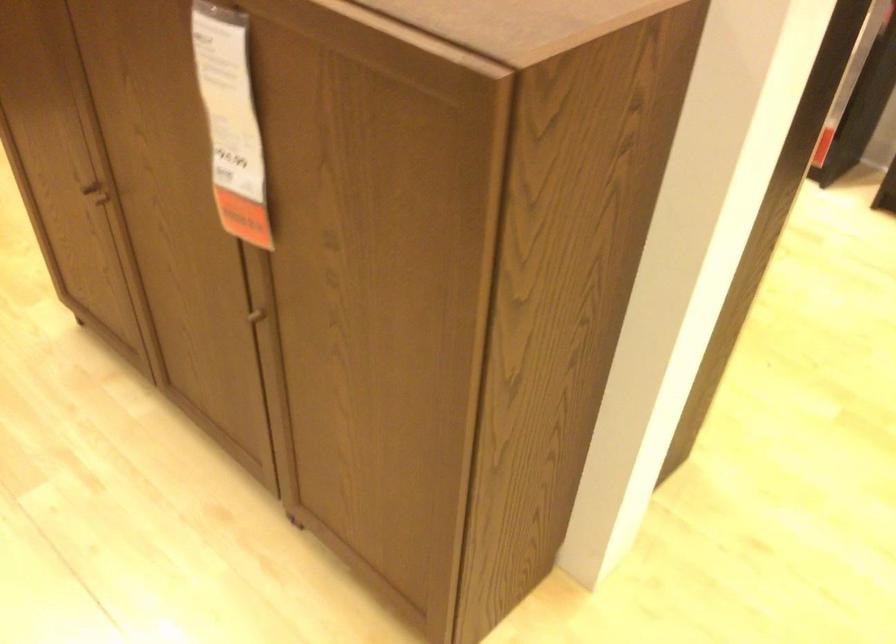
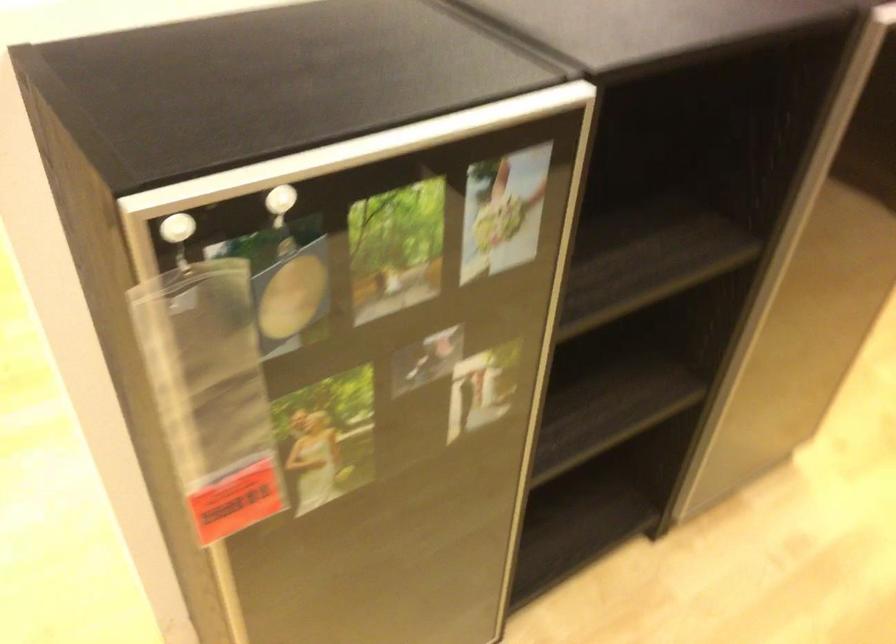
Question: I am providing you with two images of the same scene from different viewpoints. Please identify which objects are invisible in image2.

Choices:
 (A) silver door frame
 (B) brown cabinet handle
 (C) green cover book
 (D) clear plastic pouch

Answer: (B)